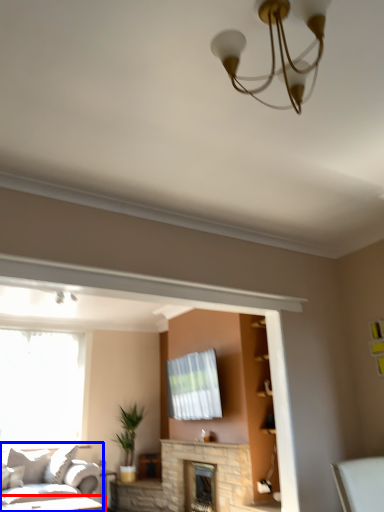
Question: Which object appears closest to the camera in this image, table (highlighted by a red box) or studio couch (highlighted by a blue box)?

Choices:
 (A) table
 (B) studio couch

Answer: (B)